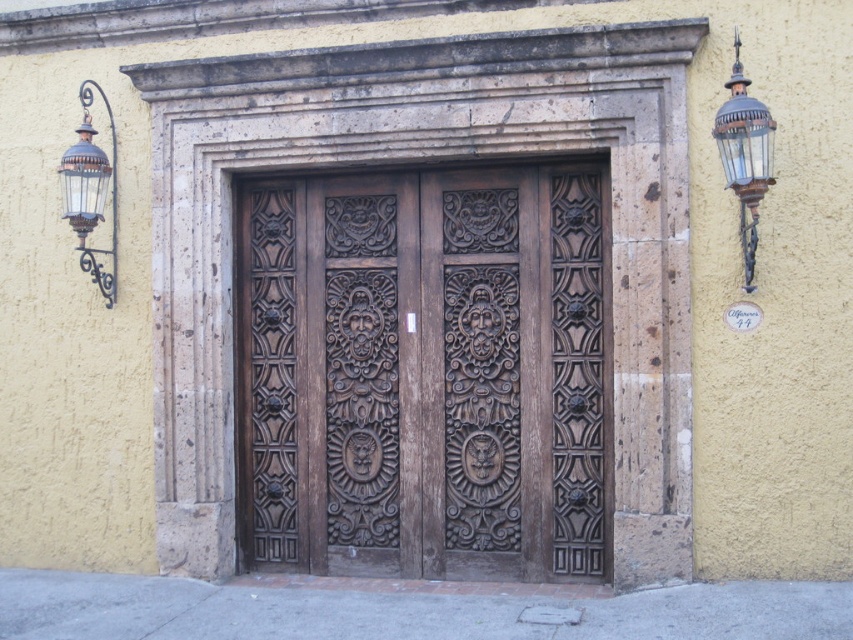
Does dark brown wood door at center appear over antique brass lantern at upper right?

Incorrect, dark brown wood door at center is not positioned above antique brass lantern at upper right.

Who is more forward, (x=537, y=294) or (x=753, y=132)?

Positioned in front is point (x=753, y=132).

This screenshot has width=853, height=640. I want to click on dark brown wood door at center, so click(x=424, y=372).

Is dark brown wood door at center smaller than antique brass lantern at left?

Incorrect, dark brown wood door at center is not smaller in size than antique brass lantern at left.

Can you confirm if dark brown wood door at center is wider than antique brass lantern at left?

Indeed, dark brown wood door at center has a greater width compared to antique brass lantern at left.

The height and width of the screenshot is (640, 853). Describe the element at coordinates (424, 372) in the screenshot. I see `dark brown wood door at center` at that location.

I want to click on dark brown wood door at center, so click(x=424, y=372).

Who is more forward, [750,244] or [90,164]?

Positioned in front is point [750,244].

Does antique brass lantern at upper right have a greater height compared to antique brass lantern at left?

Incorrect, antique brass lantern at upper right's height is not larger of antique brass lantern at left's.

At what (x,y) coordinates should I click in order to perform the action: click on antique brass lantern at upper right. Please return your answer as a coordinate pair (x, y). Looking at the image, I should click on (746, 156).